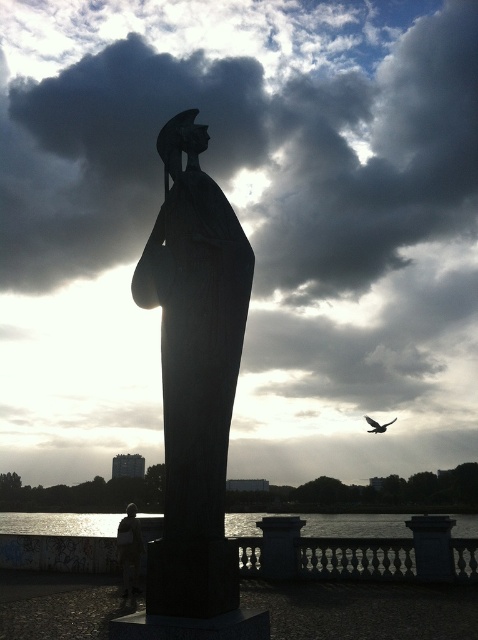
Does point (364, 531) come in front of point (123, 556)?

No, (364, 531) is behind (123, 556).

Is point (55, 529) positioned behind point (123, 586)?

Yes, point (55, 529) is behind point (123, 586).

Locate an element on the screen. Image resolution: width=478 pixels, height=640 pixels. reflective glass water at lower center is located at coordinates (60, 524).

Looking at this image, between black stone statue at center and glistening water at lower center, which one is positioned higher?

black stone statue at center

The image size is (478, 640). What are the coordinates of `black stone statue at center` in the screenshot? It's located at (195, 372).

Between dark gray concrete statue at center and dark feathered bird at upper right, which one appears on the left side from the viewer's perspective?

dark gray concrete statue at center

Does point (132, 522) come farther from viewer compared to point (375, 433)?

No, it is not.

Who is more forward, (126, 554) or (376, 422)?

Point (126, 554)

Find the location of a particular element. Image resolution: width=478 pixels, height=640 pixels. dark gray concrete statue at center is located at coordinates coord(130,548).